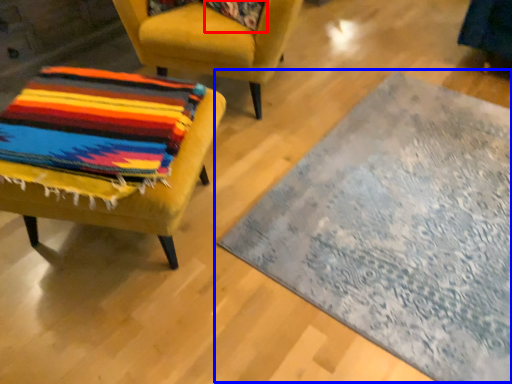
Question: Which point is further to the camera, pillow (highlighted by a red box) or mat (highlighted by a blue box)?

Choices:
 (A) pillow
 (B) mat

Answer: (A)